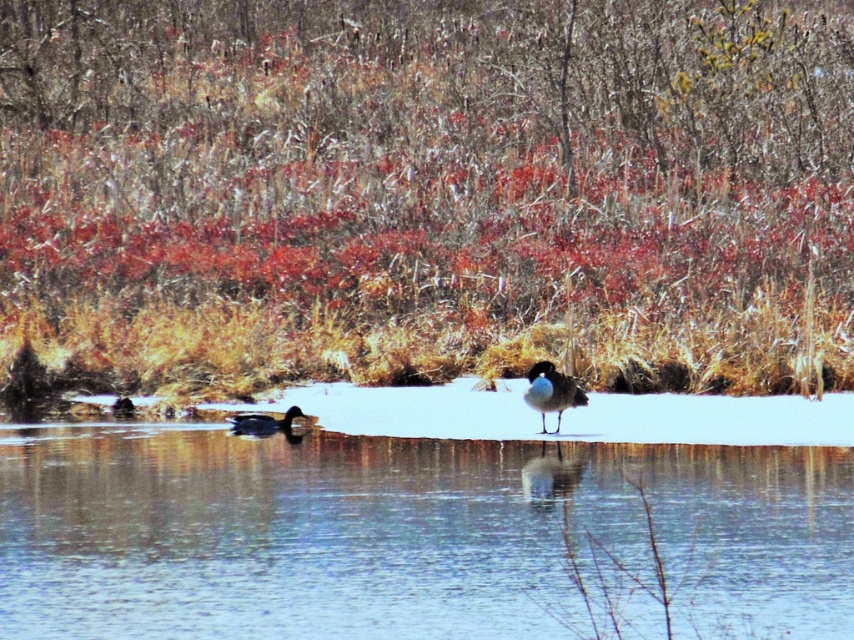
Can you confirm if brown grass at center is positioned above clear ice at center?

Indeed, brown grass at center is positioned over clear ice at center.

Which is more to the right, brown grass at center or clear ice at center?

brown grass at center is more to the right.

Where is `brown grass at center`? brown grass at center is located at coordinates (427, 192).

What do you see at coordinates (551, 392) in the screenshot? I see `white glossy duck at center` at bounding box center [551, 392].

How much distance is there between white glossy duck at center and shiny black duck at lower left?

white glossy duck at center is 6.44 feet away from shiny black duck at lower left.

Identify the location of white glossy duck at center. (551, 392).

Between point (39, 237) and point (265, 429), which one is positioned in front?

Point (265, 429) is in front.

Is point (428, 33) in front of point (273, 429)?

No, (428, 33) is further to viewer.

Describe the element at coordinates (427, 192) in the screenshot. The height and width of the screenshot is (640, 854). I see `brown grass at center` at that location.

This screenshot has width=854, height=640. In order to click on brown grass at center in this screenshot , I will do `click(427, 192)`.